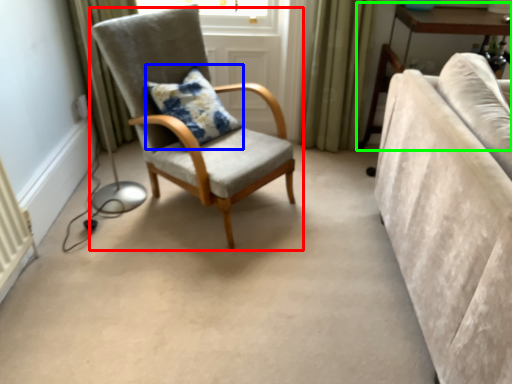
Question: Which is nearer to the chair (highlighted by a red box)? pillow (highlighted by a blue box) or table (highlighted by a green box).

Choices:
 (A) pillow
 (B) table

Answer: (A)